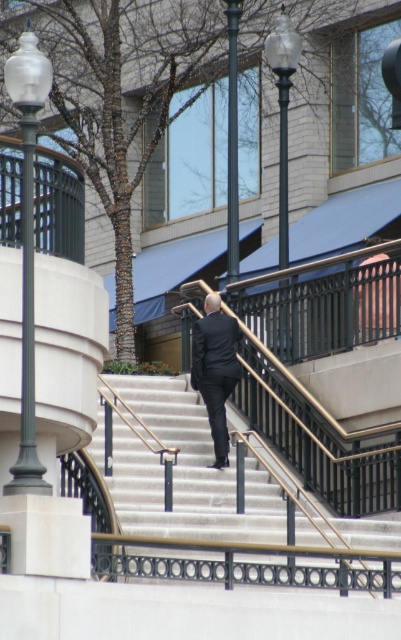
Question: Is smooth concrete stairs at center below dark suit at center?

Choices:
 (A) yes
 (B) no

Answer: (A)

Question: Is polished brass handrail at center further to camera compared to dark suit at center?

Choices:
 (A) yes
 (B) no

Answer: (B)

Question: Estimate the real-world distances between objects in this image. Which object is farther from the dark suit at center?

Choices:
 (A) smooth concrete stairs at center
 (B) polished brass handrail at center

Answer: (A)

Question: Based on their relative distances, which object is nearer to the polished brass handrail at center?

Choices:
 (A) dark suit at center
 (B) smooth concrete stairs at center

Answer: (A)

Question: Which object is the farthest from the polished brass handrail at center?

Choices:
 (A) smooth concrete stairs at center
 (B) dark suit at center

Answer: (A)

Question: Can you confirm if polished brass handrail at center is wider than dark suit at center?

Choices:
 (A) yes
 (B) no

Answer: (A)